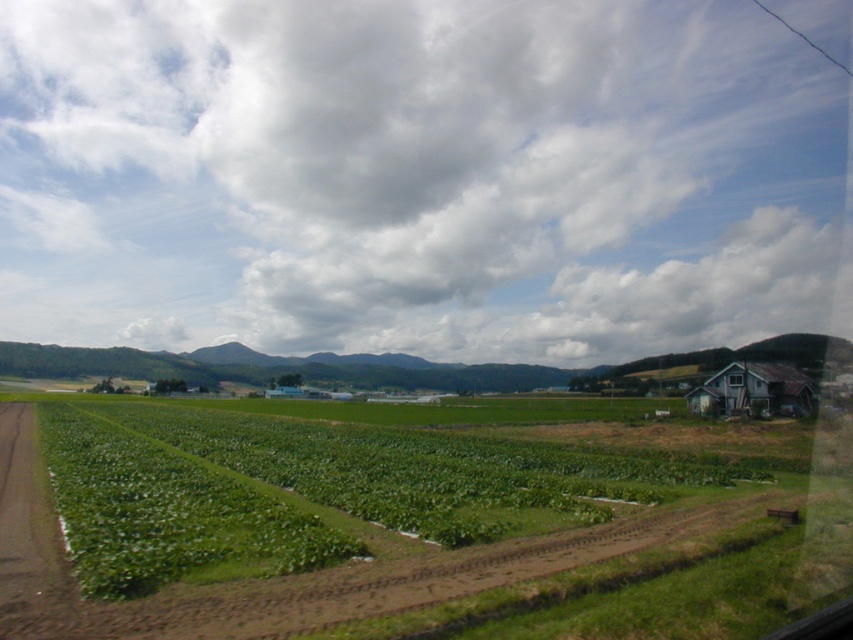
Does cloudy sky at upper center have a lesser width compared to green leafy field at center?

Incorrect, cloudy sky at upper center's width is not less than green leafy field at center's.

At what (x,y) coordinates should I click in order to perform the action: click on cloudy sky at upper center. Please return your answer as a coordinate pair (x, y). The width and height of the screenshot is (853, 640). Looking at the image, I should click on (415, 177).

You are a GUI agent. You are given a task and a screenshot of the screen. Output one action in this format:
    pyautogui.click(x=<x>, y=<y>)
    Task: Click on the cloudy sky at upper center
    The width and height of the screenshot is (853, 640).
    Given the screenshot: What is the action you would take?
    pyautogui.click(x=415, y=177)

The height and width of the screenshot is (640, 853). What do you see at coordinates (407, 524) in the screenshot? I see `green leafy field at center` at bounding box center [407, 524].

Is green leafy field at center above rusty wood house at right?

Actually, green leafy field at center is below rusty wood house at right.

You are a GUI agent. You are given a task and a screenshot of the screen. Output one action in this format:
    pyautogui.click(x=<x>, y=<y>)
    Task: Click on the green leafy field at center
    This screenshot has height=640, width=853.
    Given the screenshot: What is the action you would take?
    pyautogui.click(x=407, y=524)

Between point (373, 234) and point (787, 394), which one is positioned in front?

Point (787, 394) is more forward.

Is cloudy sky at upper center bigger than rusty wood house at right?

Correct, cloudy sky at upper center is larger in size than rusty wood house at right.

Who is more forward, (431, 44) or (801, 378)?

Point (801, 378) is in front.

Identify the location of cloudy sky at upper center. (415, 177).